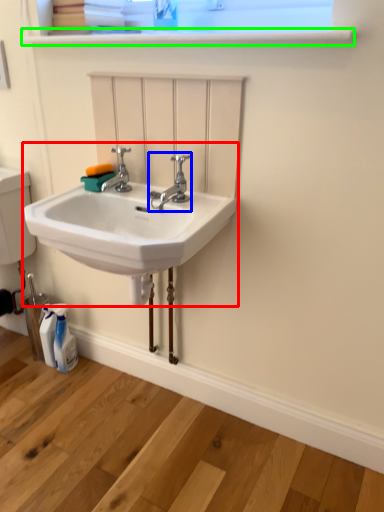
Question: Considering the real-world distances, which object is closest to sink (highlighted by a red box)? tap (highlighted by a blue box) or window sill (highlighted by a green box).

Choices:
 (A) tap
 (B) window sill

Answer: (A)